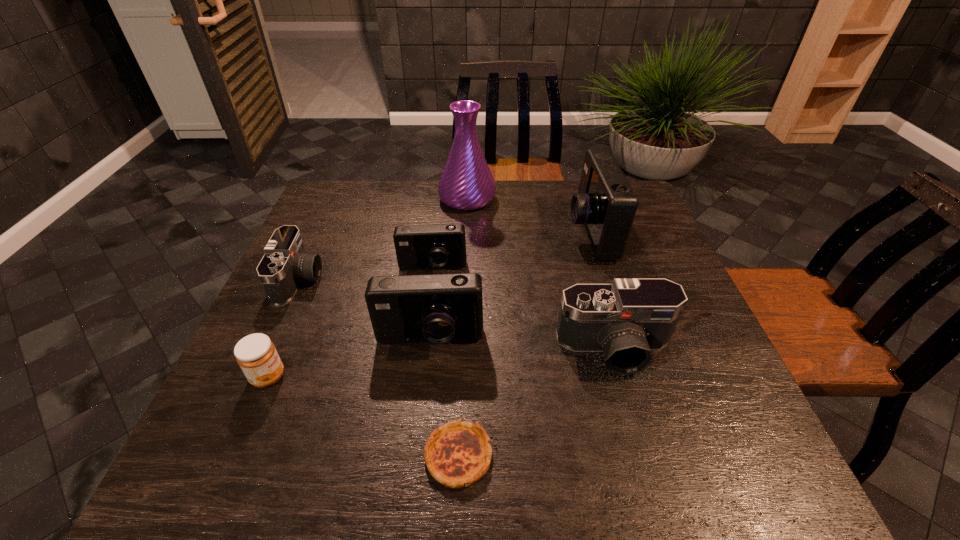
At what (x,y) coordinates should I click in order to perform the action: click on jam. Please return your answer as a coordinate pair (x, y). Looking at the image, I should click on (256, 354).

At what (x,y) coordinates should I click in order to perform the action: click on quiche. Please return your answer as a coordinate pair (x, y). The width and height of the screenshot is (960, 540). Looking at the image, I should click on pos(457,454).

Image resolution: width=960 pixels, height=540 pixels. What are the coordinates of `the shortest object` in the screenshot? It's located at click(x=457, y=454).

Find the location of a particular element. The height and width of the screenshot is (540, 960). blank area located on the left of the vase is located at coordinates (389, 199).

Locate an element on the screen. This screenshot has height=540, width=960. free point located on the front-facing side of the tallest camera is located at coordinates point(469,232).

Locate an element on the screen. vacant space located 0.210m on the front-facing side of the tallest camera is located at coordinates (494, 232).

At what (x,y) coordinates should I click in order to perform the action: click on free region located 0.070m on the front-facing side of the tallest camera. Please return your answer as a coordinate pair (x, y). The width and height of the screenshot is (960, 540). Looking at the image, I should click on (542, 232).

At what (x,y) coordinates should I click in order to perform the action: click on free space located on the front-facing side of the second biggest blue camera. Please return your answer as a coordinate pair (x, y). Looking at the image, I should click on (421, 409).

Image resolution: width=960 pixels, height=540 pixels. What are the coordinates of `free space located on the front-facing side of the bigger black camera` in the screenshot? It's located at (644, 454).

Locate an element on the screen. This screenshot has height=540, width=960. free spot located on the front-facing side of the smallest blue camera is located at coordinates (420, 376).